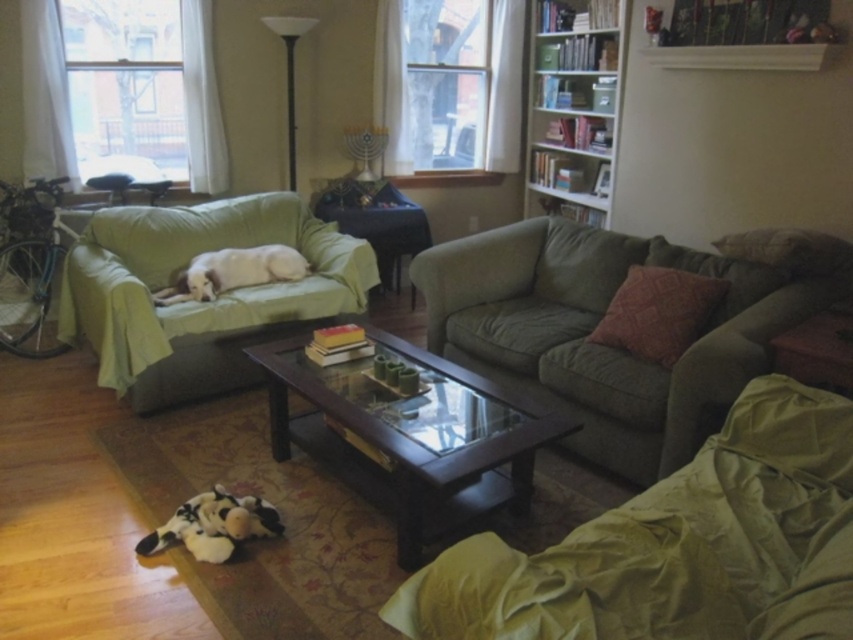
Question: Can you confirm if green fabric couch at lower right is thinner than red textured pillow at center right?

Choices:
 (A) no
 (B) yes

Answer: (A)

Question: Which point is closer to the camera?

Choices:
 (A) white soft dog at center
 (B) green fabric couch at left
 (C) white wooden bookshelf at upper right

Answer: (B)

Question: Can you confirm if green fabric couch at lower right is positioned above transparent glass window at upper left?

Choices:
 (A) yes
 (B) no

Answer: (B)

Question: Which point appears closest to the camera in this image?

Choices:
 (A) (x=579, y=68)
 (B) (x=689, y=260)
 (C) (x=634, y=346)

Answer: (C)

Question: Is green fabric couch at lower right smaller than white soft dog at center?

Choices:
 (A) no
 (B) yes

Answer: (A)

Question: Which point appears closest to the camera in this image?

Choices:
 (A) (602, 88)
 (B) (498, 106)
 (C) (599, 240)

Answer: (C)